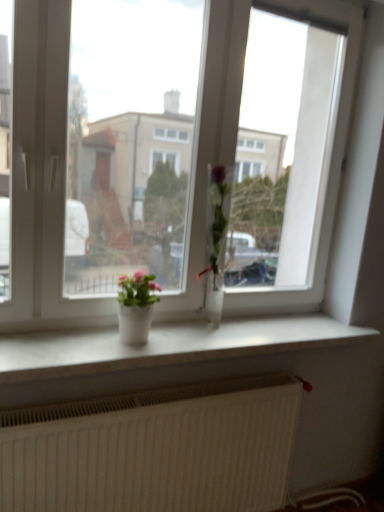
This screenshot has width=384, height=512. I want to click on vacant space to the right of matte white pot at center, arranged as the first houseplant when viewed from the left, so click(187, 343).